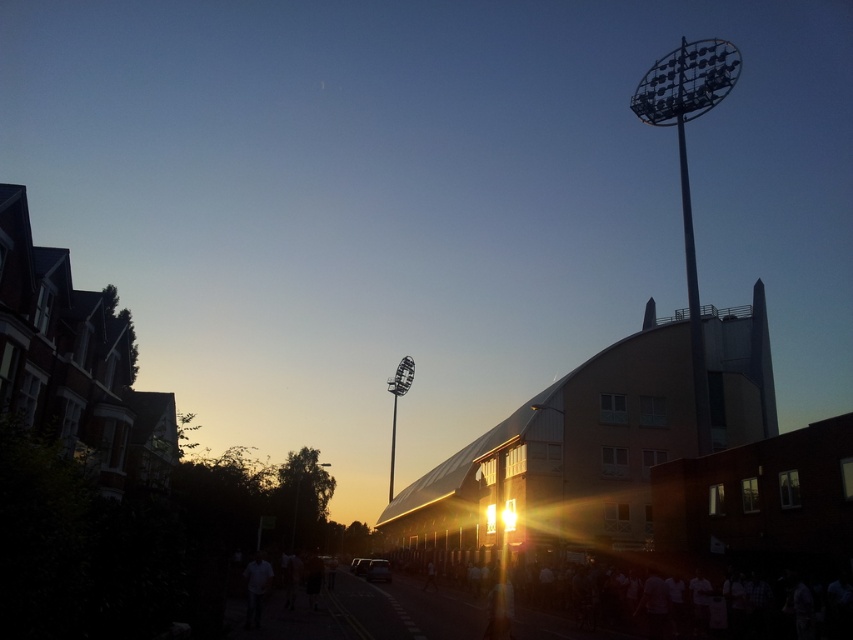
Does point (393, 564) come farther from viewer compared to point (357, 616)?

Yes, point (393, 564) is behind point (357, 616).

Is white matte crowd at lower right wider than yellow painted asphalt at center?

Indeed, white matte crowd at lower right has a greater width compared to yellow painted asphalt at center.

Is point (532, 573) positioned behind point (361, 637)?

That is True.

What are the coordinates of `white matte crowd at lower right` in the screenshot? It's located at (691, 602).